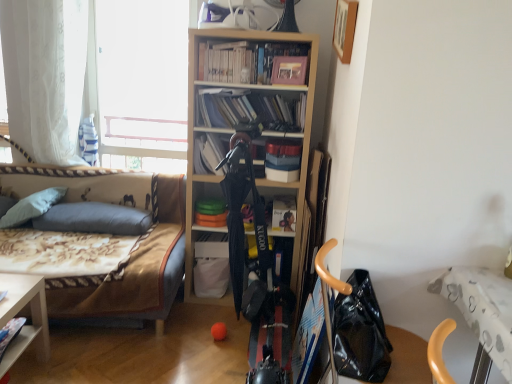
At what (x,y) coordinates should I click in order to perform the action: click on vacant space in front of orange matte ball at center. Please return your answer as a coordinate pair (x, y). The image size is (512, 384). Looking at the image, I should click on (216, 355).